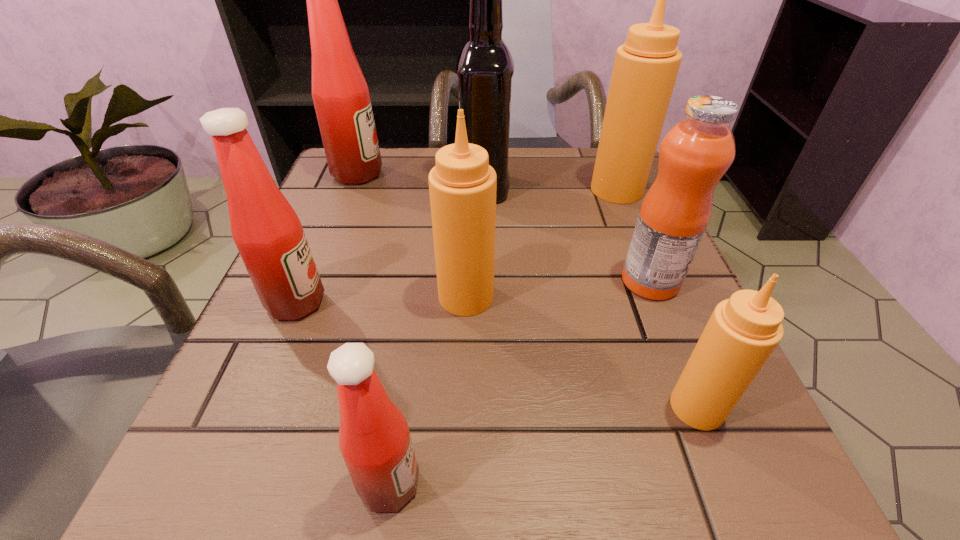
Find the location of a particular element. black liquor is located at coordinates (485, 67).

This screenshot has width=960, height=540. I want to click on the biggest red condiment, so click(341, 97).

The height and width of the screenshot is (540, 960). I want to click on the farthest tan condiment, so click(x=646, y=66).

At what (x,y) coordinates should I click in order to perform the action: click on the second farthest tan condiment. Please return your answer as a coordinate pair (x, y). The image size is (960, 540). Looking at the image, I should click on [x=462, y=186].

The width and height of the screenshot is (960, 540). In order to click on the leftmost tan condiment in this screenshot , I will do `click(462, 186)`.

Find the location of a particular element. The width and height of the screenshot is (960, 540). the second farthest red condiment is located at coordinates (268, 234).

Find the location of a particular element. fruit juice is located at coordinates (696, 152).

Identify the location of the nearest tan condiment. (743, 331).

The image size is (960, 540). Identify the location of the smallest tan condiment. (743, 331).

Locate an element on the screen. This screenshot has height=540, width=960. the smallest red condiment is located at coordinates (374, 439).